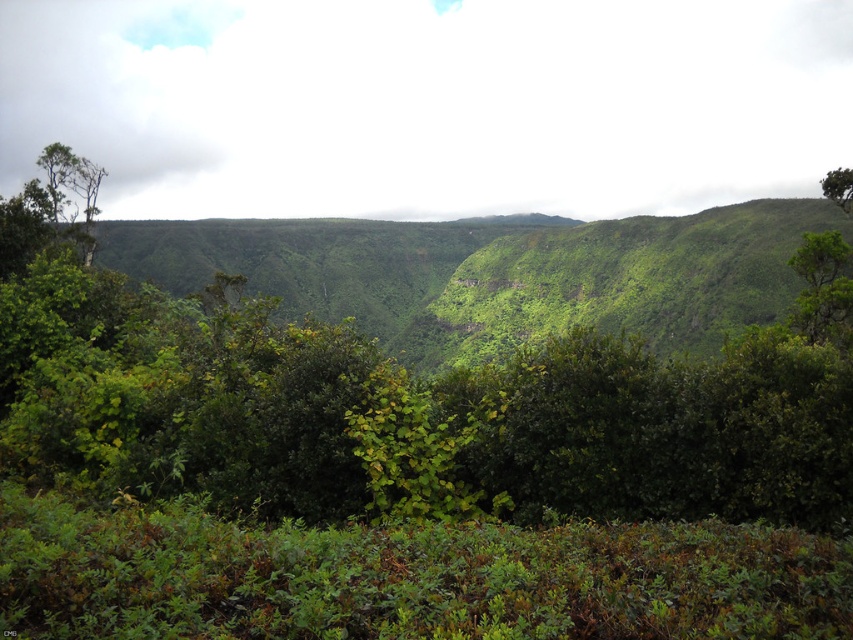
Question: Is green leafy tree at right thinner than green leafy tree at upper right?

Choices:
 (A) yes
 (B) no

Answer: (A)

Question: Does white fluffy cloud at upper center have a smaller size compared to green leafy tree at upper right?

Choices:
 (A) yes
 (B) no

Answer: (B)

Question: Which object is positioned farthest from the green leafy tree at upper right?

Choices:
 (A) green leafy tree at right
 (B) white fluffy cloud at upper center

Answer: (B)

Question: Estimate the real-world distances between objects in this image. Which object is farther from the white fluffy cloud at upper center?

Choices:
 (A) green leafy tree at right
 (B) green leafy tree at upper right

Answer: (A)

Question: Can you confirm if white fluffy cloud at upper center is positioned to the left of green leafy tree at upper right?

Choices:
 (A) no
 (B) yes

Answer: (B)

Question: Which of these objects is positioned farthest from the green leafy tree at upper right?

Choices:
 (A) green leafy tree at right
 (B) white fluffy cloud at upper center

Answer: (B)